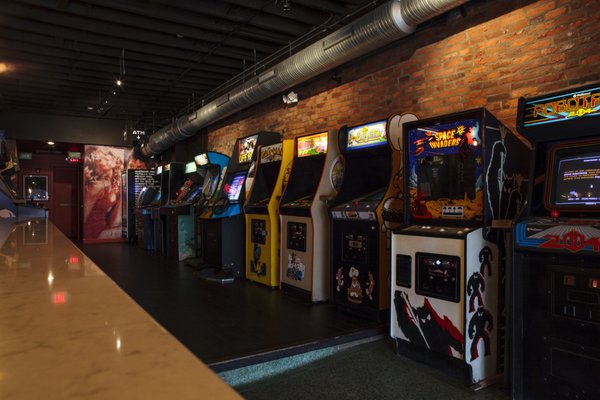
At what (x,y) coordinates should I click in order to perform the action: click on exit sign. Please return your answer as a coordinate pair (x, y). The width and height of the screenshot is (600, 400). Looking at the image, I should click on (69, 155).